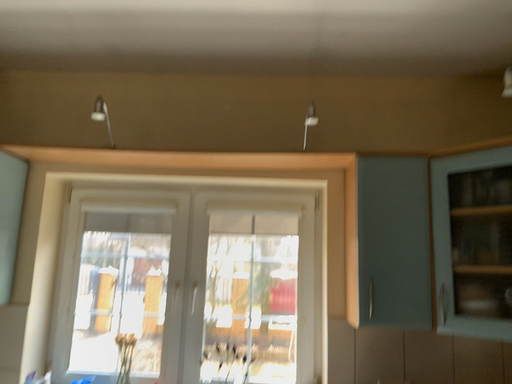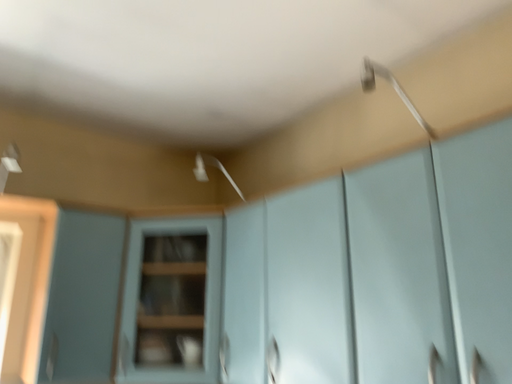
Question: Which way did the camera rotate in the video?

Choices:
 (A) rotated right
 (B) rotated left

Answer: (A)